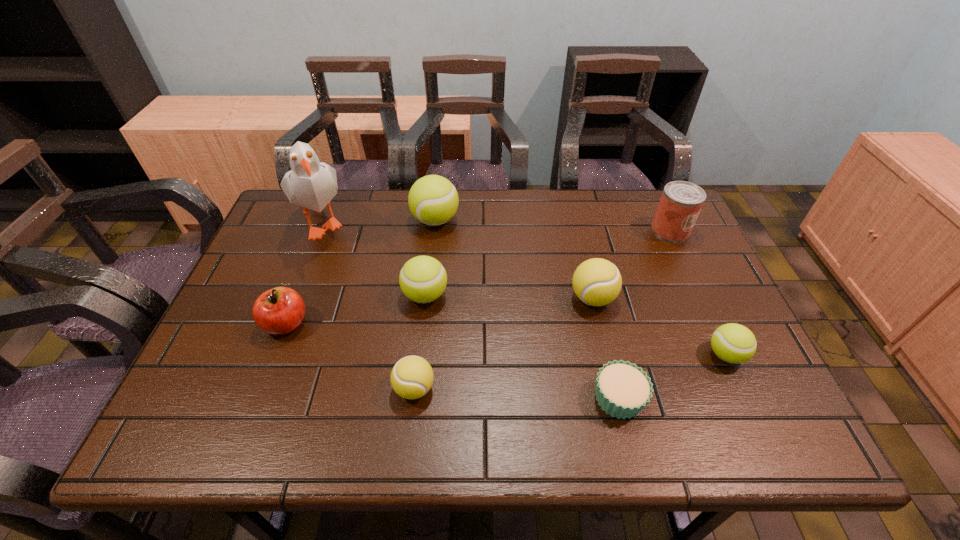
Where is `unoccupied position between the red apple and the tallest object`? This screenshot has height=540, width=960. unoccupied position between the red apple and the tallest object is located at coordinates (305, 273).

At what (x,y) coordinates should I click in order to perform the action: click on free area in between the tallest object and the cupcake. Please return your answer as a coordinate pair (x, y). The height and width of the screenshot is (540, 960). Looking at the image, I should click on (471, 310).

Identify the location of empty space between the second nearest green tennis ball and the tallest object. (374, 259).

Locate an element on the screen. This screenshot has height=540, width=960. empty space that is in between the apple and the can is located at coordinates 478,277.

Where is `free space between the tallest object and the right yellow tennis ball`? Image resolution: width=960 pixels, height=540 pixels. free space between the tallest object and the right yellow tennis ball is located at coordinates (459, 260).

Identify which object is the eighth nearest to the right yellow tennis ball. Please provide its 2D coordinates. Your answer should be formatted as a tuple, i.e. [(x, y)], where the tuple contains the x and y coordinates of a point satisfying the conditions above.

[(278, 311)]

At what (x,y) coordinates should I click in order to perform the action: click on the seventh closest object to the nearest green tennis ball. Please return your answer as a coordinate pair (x, y). Looking at the image, I should click on (278, 311).

I want to click on tennis ball that is the third closest to the cupcake, so click(x=412, y=377).

This screenshot has height=540, width=960. What are the coordinates of `tennis ball that is the second closest to the smallest green tennis ball` in the screenshot? It's located at pyautogui.click(x=423, y=279).

Locate which green tennis ball ranks second in proximity to the second smallest green tennis ball. Please provide its 2D coordinates. Your answer should be formatted as a tuple, i.e. [(x, y)], where the tuple contains the x and y coordinates of a point satisfying the conditions above.

[(733, 343)]